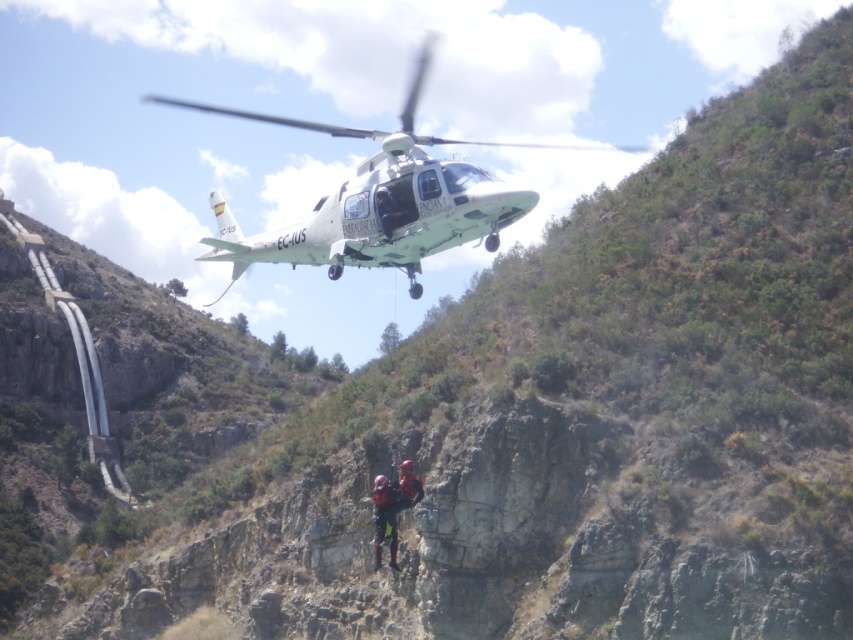
Question: Does camouflage paint helicopter at center have a greater width compared to black rubber helmet at center?

Choices:
 (A) no
 (B) yes

Answer: (B)

Question: Does camouflage paint helicopter at center appear on the right side of black rubber helmet at center?

Choices:
 (A) no
 (B) yes

Answer: (A)

Question: Which object is positioned closest to the camouflage paint helicopter at center?

Choices:
 (A) camouflage fabric helmet at center
 (B) black rubber helmet at center

Answer: (A)

Question: Estimate the real-world distances between objects in this image. Which object is farther from the camouflage paint helicopter at center?

Choices:
 (A) camouflage fabric helmet at center
 (B) black rubber helmet at center

Answer: (B)

Question: Which of the following is the farthest from the observer?

Choices:
 (A) black rubber helmet at center
 (B) camouflage fabric helmet at center
 (C) camouflage paint helicopter at center

Answer: (A)

Question: Can you confirm if black rubber helmet at center is smaller than camouflage fabric helmet at center?

Choices:
 (A) yes
 (B) no

Answer: (A)